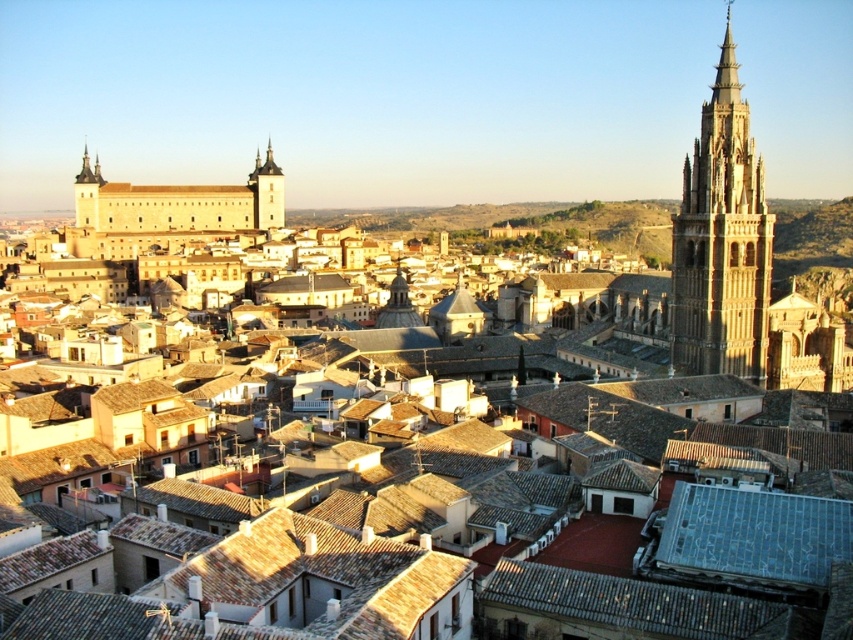
Can you confirm if stone gothic tower at right is positioned above light brown stone tower at center-left?

Incorrect, stone gothic tower at right is not positioned above light brown stone tower at center-left.

The width and height of the screenshot is (853, 640). Describe the element at coordinates (722, 241) in the screenshot. I see `stone gothic tower at right` at that location.

Find the location of a particular element. This screenshot has width=853, height=640. stone gothic tower at right is located at coordinates (722, 241).